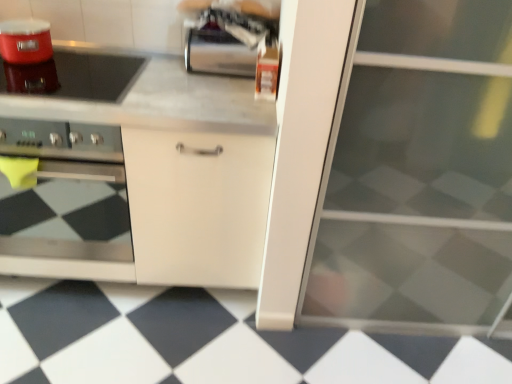
At what (x,y) coordinates should I click in order to perform the action: click on free location in front of satin metallic paper towel holder at upper center. Please return your answer as a coordinate pair (x, y). The height and width of the screenshot is (384, 512). Looking at the image, I should click on (205, 88).